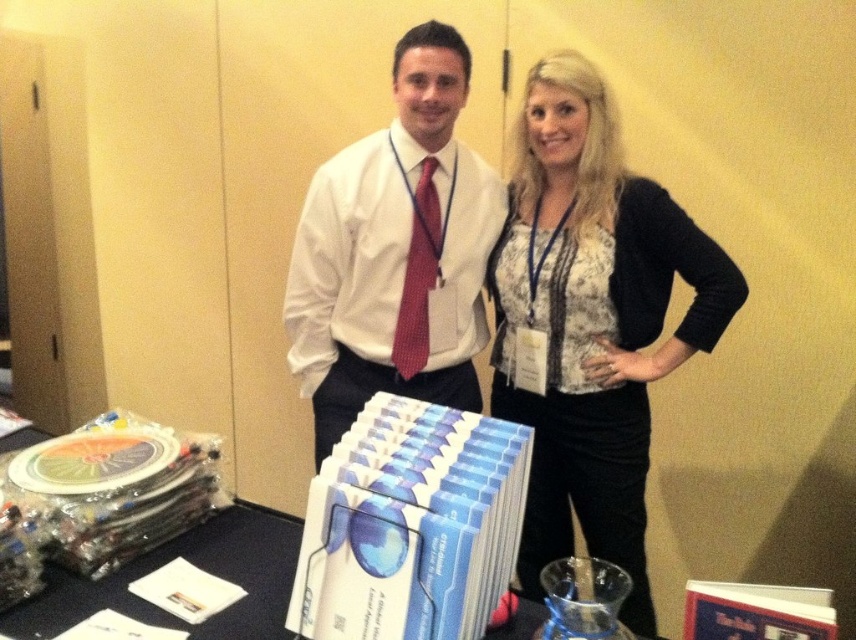
Does point (669, 234) come behind point (340, 237)?

No, it is in front of (340, 237).

Who is lower down, white lace blouse at center or white shirt at center?

white lace blouse at center

Between point (619, 288) and point (402, 90), which one is positioned behind?

Point (402, 90)

Find the location of a particular element. Image resolution: width=856 pixels, height=640 pixels. white lace blouse at center is located at coordinates (591, 321).